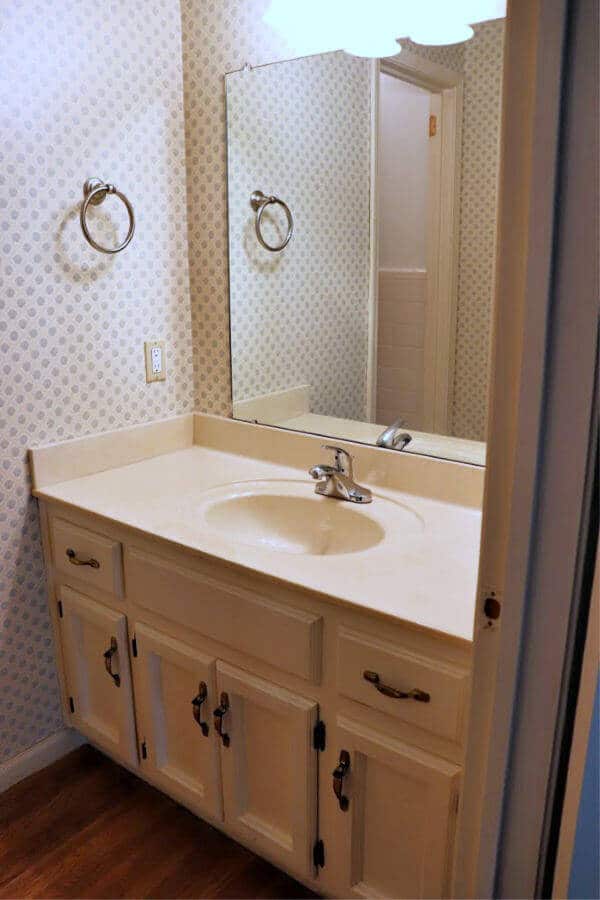
The width and height of the screenshot is (600, 900). Identify the location of mirror. (411, 322).